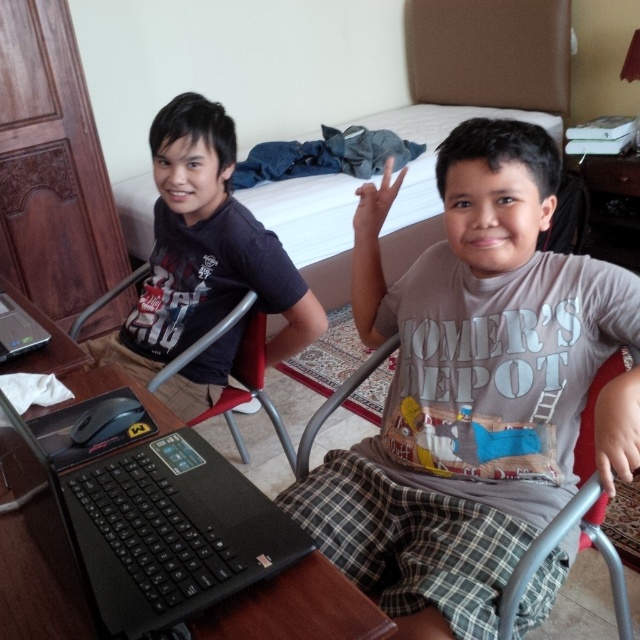
Question: Does gray cotton t-shirt at center have a greater width compared to red plastic chair at left?

Choices:
 (A) no
 (B) yes

Answer: (B)

Question: Is black matte laptop at lower left positioned in front of matte black shirt at left?

Choices:
 (A) no
 (B) yes

Answer: (B)

Question: Which object is farther from the camera taking this photo?

Choices:
 (A) gray cotton t-shirt at center
 (B) black matte laptop at left
 (C) matte black shirt at left
 (D) red plastic chair at left

Answer: (C)

Question: Does gray cotton t-shirt at center have a greater width compared to red plastic chair at left?

Choices:
 (A) yes
 (B) no

Answer: (A)

Question: Which point is closer to the camera?

Choices:
 (A) matte black shirt at left
 (B) gray cotton t-shirt at center
 (C) black matte laptop at left
 (D) red plastic chair at left

Answer: (B)

Question: Which of the following is the closest to the observer?

Choices:
 (A) (237, 262)
 (B) (8, 326)

Answer: (B)